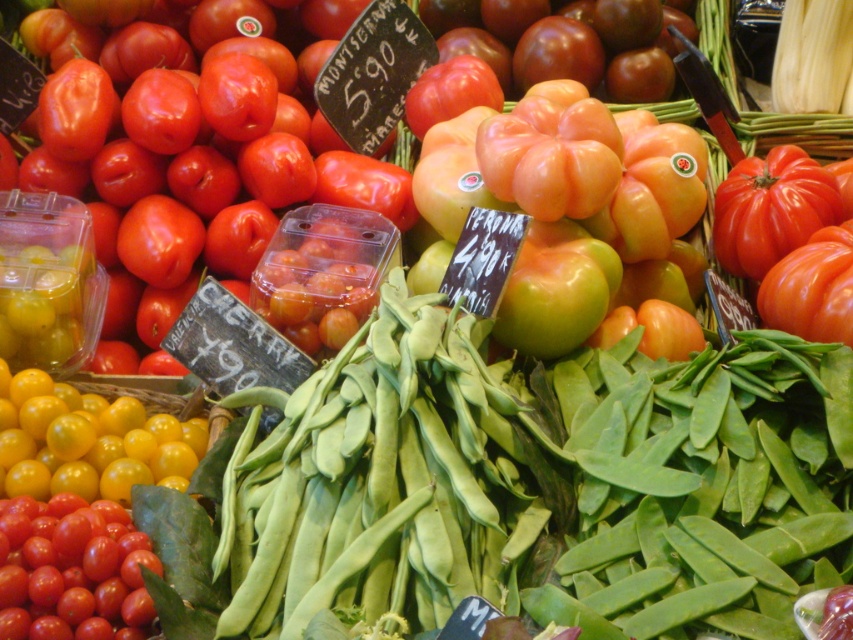
You are a customer at the market stall and want to buy both the glossy cherry tomatoes at center and the orange matte tomato at center. The shelf where you place them must have enough height to accommodate both. The shelf is 15 cm tall. Can you determine if both items will fit vertically on the shelf?

The glossy cherry tomatoes at center are taller than the orange matte tomato at center. Since the shelf is 15 cm tall, and the height of the glossy cherry tomatoes at center is not specified, it is impossible to determine if they will fit vertically on the shelf.

You are a customer at the market stall and want to buy some cherry tomatoes. You see the glossy cherry tomatoes at center and the shiny red cherry tomatoes at lower left. Which one is located to the right side?

The glossy cherry tomatoes at center is located to the right of the shiny red cherry tomatoes at lower left.

You are a customer at the market stall and want to buy the larger of the two tomatoes. Which one should you choose between the glossy cherry tomatoes at center and the orange matte tomato at center?

The glossy cherry tomatoes at center are bigger than the orange matte tomato at center, so you should choose the glossy cherry tomatoes at center.